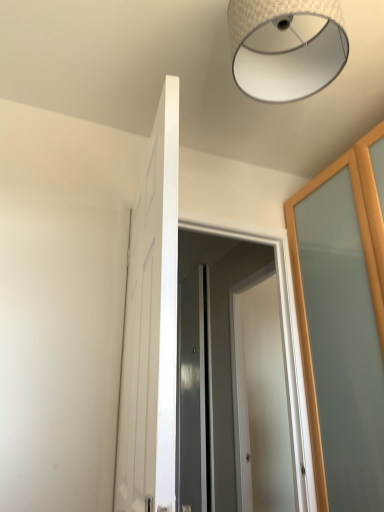
Question: Does woven fabric lampshade at upper center have a greater width compared to satin gray screen door at center?

Choices:
 (A) yes
 (B) no

Answer: (A)

Question: From a real-world perspective, does woven fabric lampshade at upper center sit lower than satin gray screen door at center?

Choices:
 (A) no
 (B) yes

Answer: (A)

Question: Is woven fabric lampshade at upper center thinner than satin gray screen door at center?

Choices:
 (A) no
 (B) yes

Answer: (A)

Question: Is woven fabric lampshade at upper center far from satin gray screen door at center?

Choices:
 (A) no
 (B) yes

Answer: (B)

Question: Does woven fabric lampshade at upper center appear on the left side of satin gray screen door at center?

Choices:
 (A) no
 (B) yes

Answer: (A)

Question: Would you say woven fabric lampshade at upper center contains satin gray screen door at center?

Choices:
 (A) no
 (B) yes

Answer: (A)

Question: Can you confirm if satin gray screen door at center is thinner than white glossy door at center, which is counted as the first door, starting from the front?

Choices:
 (A) yes
 (B) no

Answer: (A)

Question: Is satin gray screen door at center smaller than white glossy door at center, which ranks as the 1th door in left-to-right order?

Choices:
 (A) yes
 (B) no

Answer: (A)

Question: Is satin gray screen door at center to the right of white glossy door at center, placed as the 2th door when sorted from back to front, from the viewer's perspective?

Choices:
 (A) yes
 (B) no

Answer: (A)

Question: Can you confirm if satin gray screen door at center is bigger than white glossy door at center, which is counted as the first door, starting from the front?

Choices:
 (A) yes
 (B) no

Answer: (B)

Question: Is satin gray screen door at center completely or partially outside of white glossy door at center, which ranks as the 1th door in left-to-right order?

Choices:
 (A) no
 (B) yes

Answer: (B)

Question: From a real-world perspective, is satin gray screen door at center positioned over white glossy door at center, which ranks as the 1th door in left-to-right order, based on gravity?

Choices:
 (A) yes
 (B) no

Answer: (B)

Question: Is white glossy door at center, marked as the second door in a right-to-left arrangement, next to satin gray screen door at center and touching it?

Choices:
 (A) no
 (B) yes

Answer: (A)